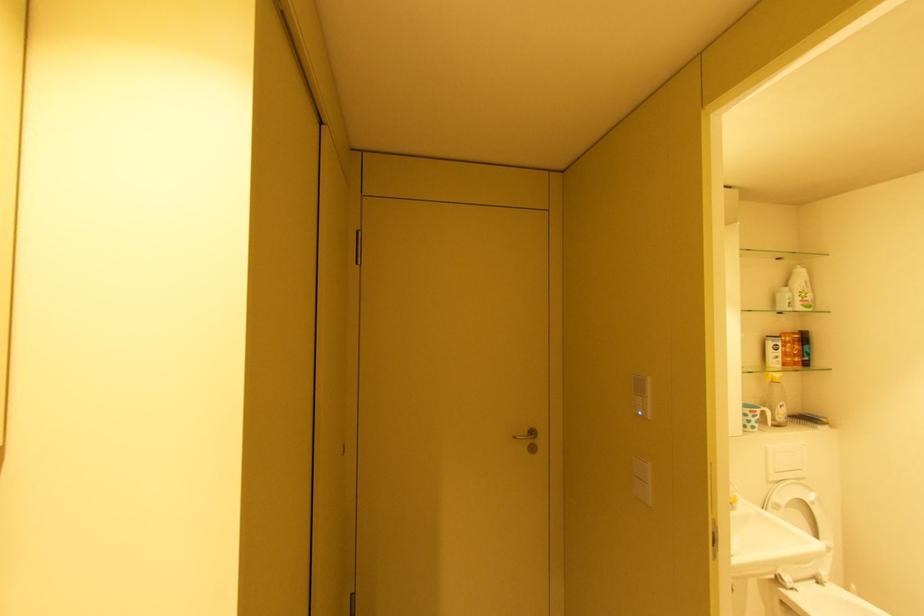
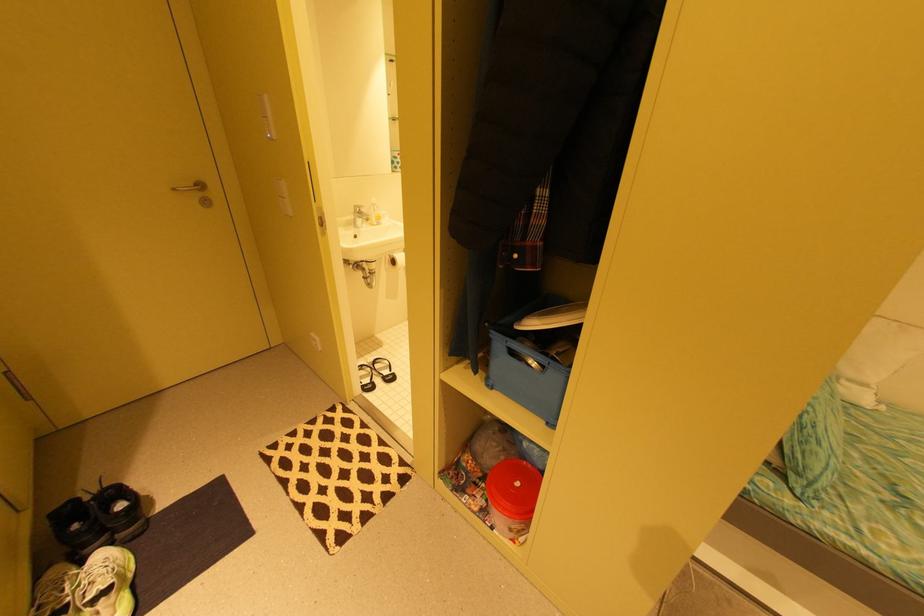
Find the pixel in the second image that matches the point at 520,438 in the first image.

(179, 190)